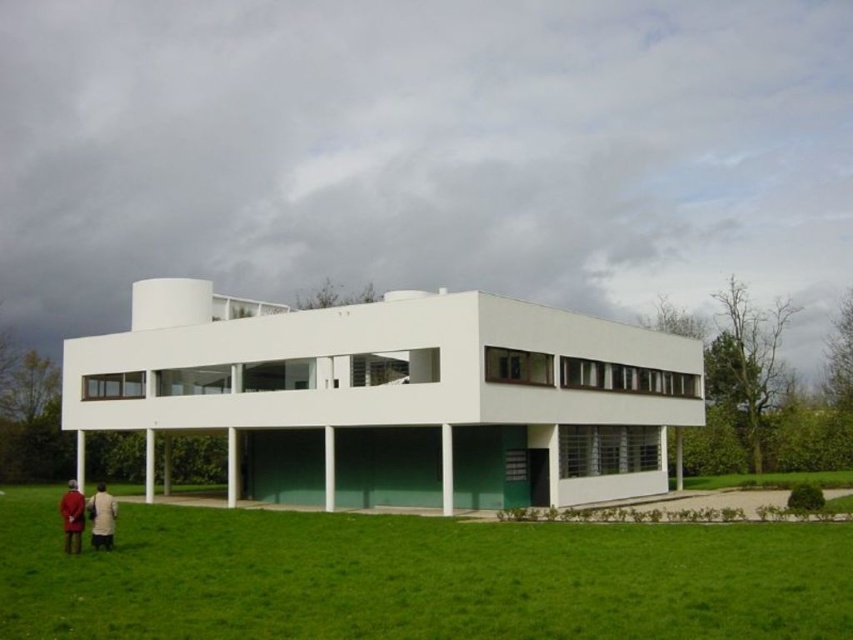
Is green grass at lower left to the right of light beige coat at lower left from the viewer's perspective?

Correct, you'll find green grass at lower left to the right of light beige coat at lower left.

The image size is (853, 640). I want to click on green grass at lower left, so click(416, 577).

Measure the distance between point (210,605) and camera.

Point (210,605) and camera are 49.08 feet apart from each other.

Identify the location of green grass at lower left. (416, 577).

Is light beige coat at lower left smaller than red wool coat at lower left?

Yes, light beige coat at lower left is smaller than red wool coat at lower left.

Between point (97, 502) and point (67, 531), which one is positioned behind?

Point (67, 531)

Identify the location of light beige coat at lower left. pos(102,516).

Who is positioned more to the left, green grass at lower left or matte red coat at lower left?

Positioned to the left is matte red coat at lower left.

Is point (141, 531) more distant than point (103, 486)?

No, (141, 531) is in front of (103, 486).

Based on the photo, measure the distance between point (6, 500) and camera.

The distance of point (6, 500) from camera is 139.77 feet.

Identify the location of green grass at lower left. (416, 577).